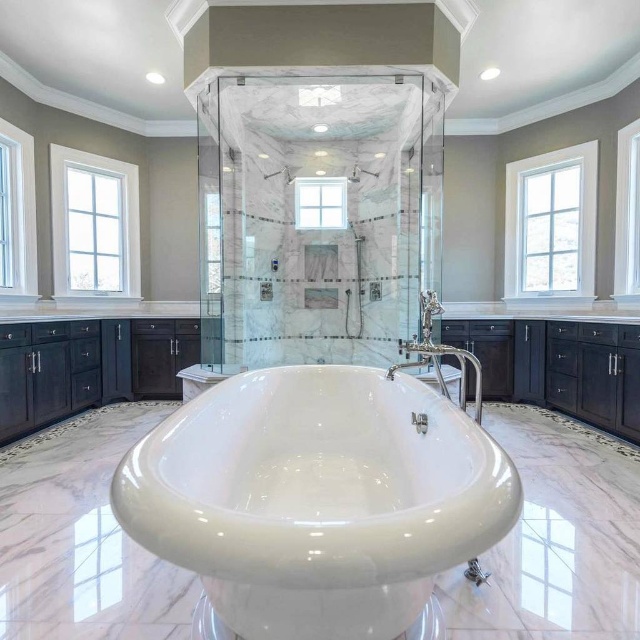
Which is behind, point (64, 268) or point (24, 260)?

Positioned behind is point (64, 268).

Where is `white glass window at left`? The width and height of the screenshot is (640, 640). white glass window at left is located at coordinates (93, 225).

Where is `white glass window at left`? This screenshot has height=640, width=640. white glass window at left is located at coordinates (93, 225).

Is point (60, 376) positioned before point (476, 401)?

That is True.

In the scene shown: Which is more to the right, black glossy vanity at center or polished chrome faucet at center?

polished chrome faucet at center

At what (x,y) coordinates should I click in order to perform the action: click on black glossy vanity at center. Please return your answer as a coordinate pair (x, y). Looking at the image, I should click on (90, 364).

Can you confirm if white wood window at upper right is thinner than clear glass window at center?

In fact, white wood window at upper right might be wider than clear glass window at center.

Where is `white wood window at upper right`? This screenshot has height=640, width=640. white wood window at upper right is located at coordinates (552, 225).

Identify the location of white wood window at upper right. Image resolution: width=640 pixels, height=640 pixels. (552, 225).